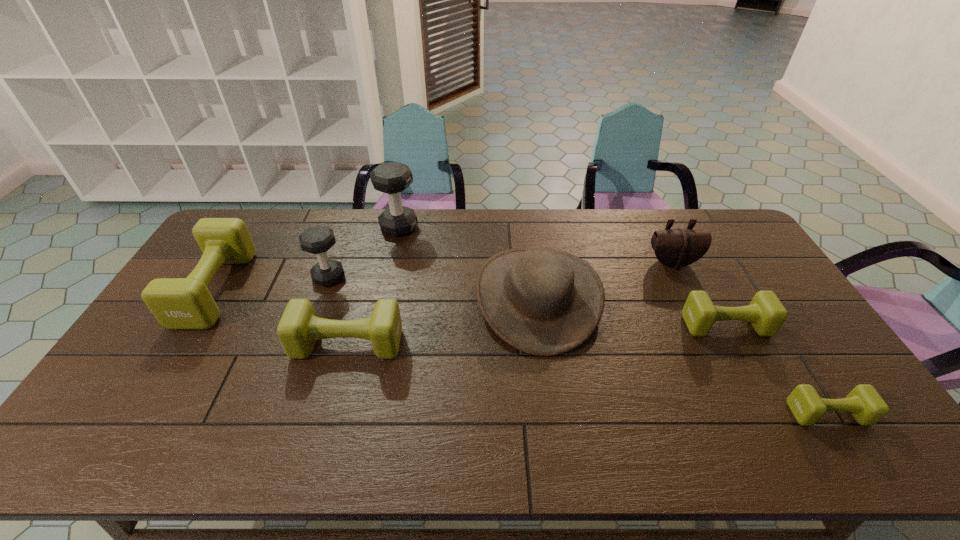
Where is `vacant space situated on the left of the third olive dumbbell from right to left`? vacant space situated on the left of the third olive dumbbell from right to left is located at coordinates (203, 343).

Find the location of `vacant area situated 0.080m on the back of the seventh tallest object`. vacant area situated 0.080m on the back of the seventh tallest object is located at coordinates (709, 294).

Locate an element on the screen. This screenshot has height=540, width=960. vacant area situated 0.300m on the back of the shortest object is located at coordinates (763, 313).

Identify the location of dumbbell that is at the far edge. This screenshot has height=540, width=960. (392, 178).

At what (x,y) coordinates should I click in order to perform the action: click on cowboy hat positioned at the far edge. Please return your answer as a coordinate pair (x, y). The height and width of the screenshot is (540, 960). Looking at the image, I should click on (542, 301).

Image resolution: width=960 pixels, height=540 pixels. I want to click on object that is at the near edge, so click(865, 404).

You are a GUI agent. You are given a task and a screenshot of the screen. Output one action in this format:
    pyautogui.click(x=<x>, y=<y>)
    Task: Click on the object present at the left edge
    The image size is (960, 540).
    Given the screenshot: What is the action you would take?
    pyautogui.click(x=177, y=303)

Find the location of a particular element. object that is at the near right corner is located at coordinates (865, 404).

In the image, there is a desktop. Identify the location of vacant area at the far edge. The width and height of the screenshot is (960, 540). (476, 248).

The height and width of the screenshot is (540, 960). In the image, there is a desktop. Find the location of `vacant space at the near edge`. vacant space at the near edge is located at coordinates (262, 457).